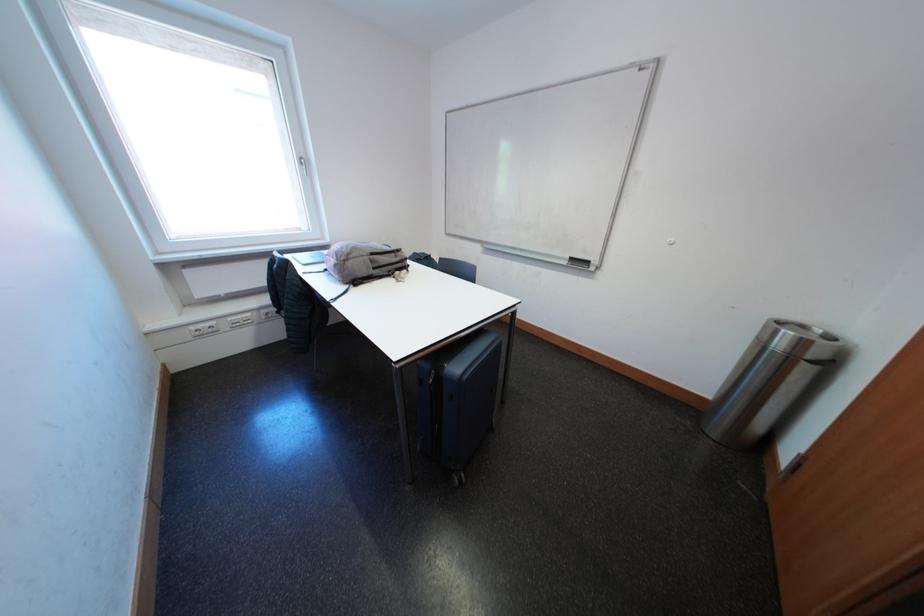
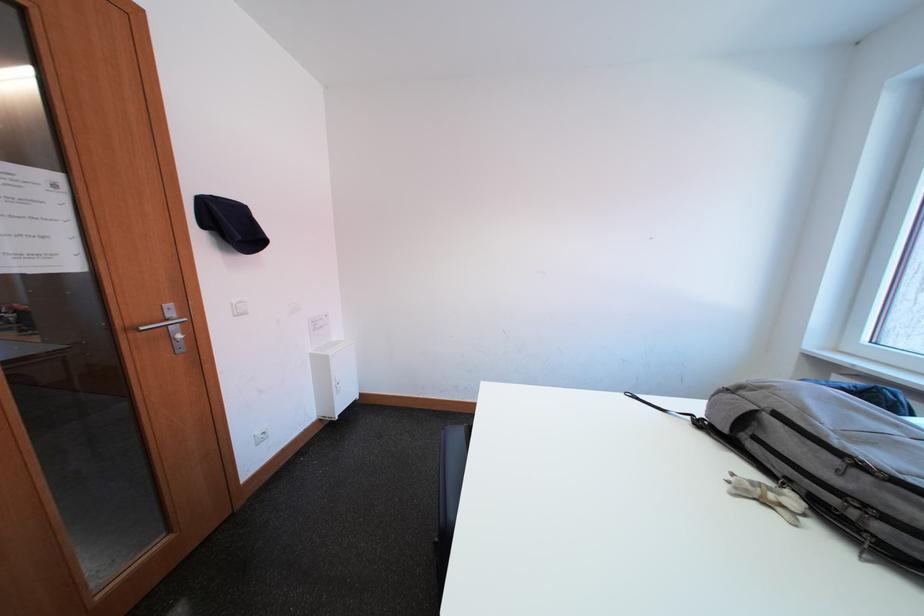
Locate, in the second image, the point that corresponds to point 371,286 in the first image.

(719, 438)